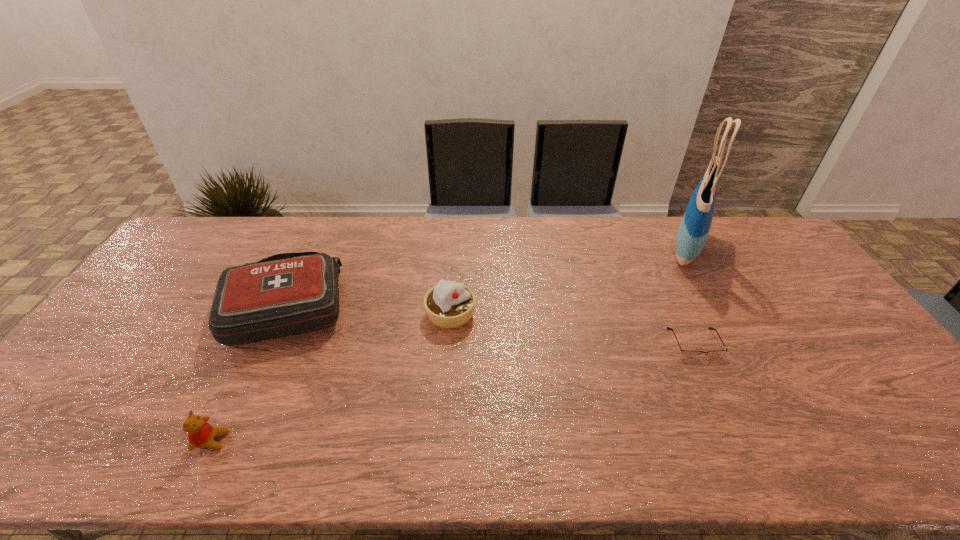
Locate an element on the screen. object located at the far edge is located at coordinates 694,228.

At what (x,y) coordinates should I click in order to perform the action: click on object positioned at the near edge. Please return your answer as a coordinate pair (x, y). The width and height of the screenshot is (960, 540). Looking at the image, I should click on (201, 434).

Locate an element on the screen. The height and width of the screenshot is (540, 960). free spot at the far edge of the desktop is located at coordinates (330, 249).

Find the location of a particular element. The image size is (960, 540). vacant space at the near edge of the desktop is located at coordinates (817, 431).

You are a GUI agent. You are given a task and a screenshot of the screen. Output one action in this format:
    pyautogui.click(x=<x>, y=<y>)
    Task: Click on the vacant space at the left edge of the desktop
    The image size is (960, 540).
    Given the screenshot: What is the action you would take?
    pyautogui.click(x=49, y=417)

Find the location of `empty location between the teddy bear and the whipped cream`. empty location between the teddy bear and the whipped cream is located at coordinates (331, 377).

Identify the location of blank region between the teddy bear and the shortest object. (453, 392).

Where is `free space between the first-aid kit and the tote bag`? The width and height of the screenshot is (960, 540). free space between the first-aid kit and the tote bag is located at coordinates (487, 276).

Find the location of a particular element. The width and height of the screenshot is (960, 540). blank region between the third object from right to left and the teddy bear is located at coordinates (331, 377).

Where is `free point between the tote bag and the whipped cream`? free point between the tote bag and the whipped cream is located at coordinates (568, 280).